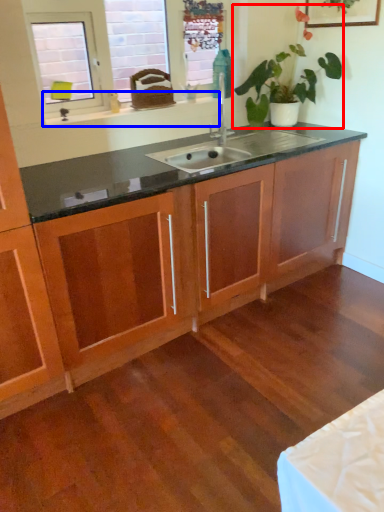
Question: Among these objects, which one is farthest to the camera, houseplant (highlighted by a red box) or window sill (highlighted by a blue box)?

Choices:
 (A) houseplant
 (B) window sill

Answer: (B)